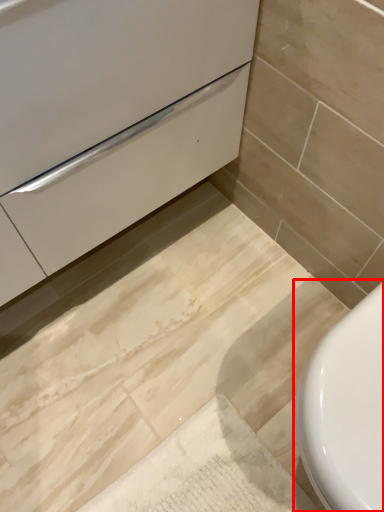
Question: Observing the image, what is the correct spatial positioning of toilet (annotated by the red box) in reference to drawer?

Choices:
 (A) left
 (B) right

Answer: (B)